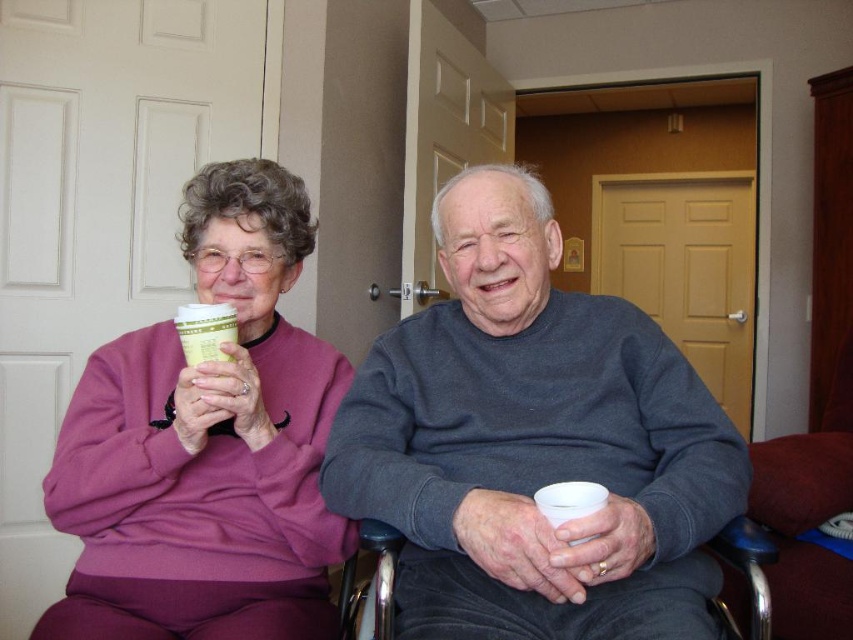
Question: Which point appears farthest from the camera in this image?

Choices:
 (A) click(271, 492)
 (B) click(485, 348)
 (C) click(225, 316)

Answer: (B)

Question: Is matte purple sweater at upper left smaller than green paper cup at upper left?

Choices:
 (A) yes
 (B) no

Answer: (B)

Question: Observing the image, what is the correct spatial positioning of gray sweater at center in reference to matte purple sweater at upper left?

Choices:
 (A) right
 (B) left

Answer: (A)

Question: Which of these objects is positioned farthest from the green paper cup at upper left?

Choices:
 (A) matte purple sweater at upper left
 (B) gray sweater at center

Answer: (B)

Question: Which point is closer to the camera?

Choices:
 (A) [204, 330]
 (B) [511, 323]
 (C) [260, 198]

Answer: (A)

Question: Does gray sweater at center have a lesser width compared to green paper cup at upper left?

Choices:
 (A) no
 (B) yes

Answer: (A)